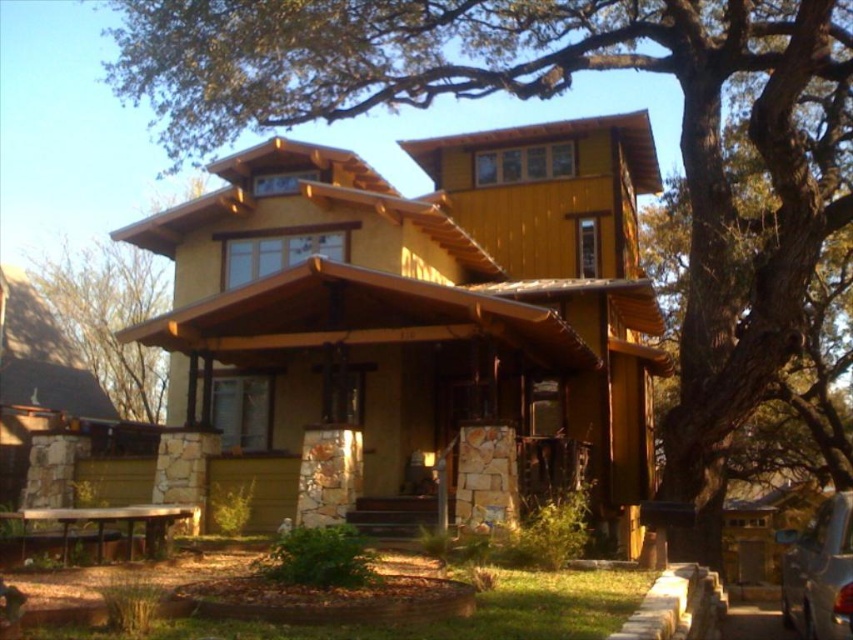
You are a delivery person trying to park your metallic silver car at lower right near the house. There is a green leafy tree at left in the way. Can you park your car there without damaging the tree?

The green leafy tree at left is thinner than the metallic silver car at lower right, so the car is wider. This means there might not be enough space to park the car without potentially damaging the tree, as the car is wider than the tree, indicating a narrower space than needed.

You are standing in front of the house and want to park your car so it is hidden from view by the tree. Is the metallic silver car at lower right currently positioned to the right of the green leafy tree at left, making it visible? Please explain using their positions.

The green leafy tree at left is to the left of the metallic silver car at lower right, so the metallic silver car at lower right is positioned to the right of the green leafy tree at left. This means the car is visible and not hidden by the tree.